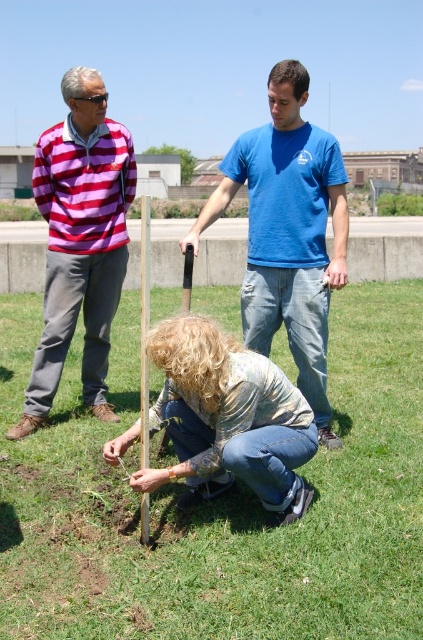
Is green grass at center taller than smooth gray concrete at center?

In fact, green grass at center may be shorter than smooth gray concrete at center.

Which is behind, point (406, 460) or point (153, 150)?

The point (153, 150) is more distant.

Locate an element on the screen. green grass at center is located at coordinates (219, 502).

Is green grass at center above striped cotton shirt at left?

Incorrect, green grass at center is not positioned above striped cotton shirt at left.

How much distance is there between green grass at center and striped cotton shirt at left?

The distance of green grass at center from striped cotton shirt at left is 3.37 meters.

Is point (400, 308) positioned before point (102, 125)?

That is False.

The image size is (423, 640). I want to click on green grass at center, so (219, 502).

Based on the photo, who is taller, green grass at center or denim jeans at center?

Standing taller between the two is denim jeans at center.

Find the location of a particular element. The width and height of the screenshot is (423, 640). green grass at center is located at coordinates (219, 502).

Find the location of `green grass at center`. green grass at center is located at coordinates (219, 502).